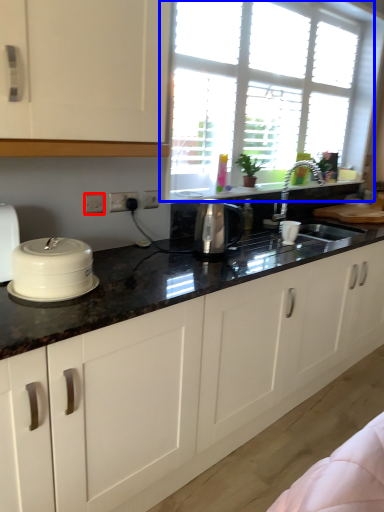
Question: Which of the following is the farthest to the observer, electric outlet (highlighted by a red box) or window (highlighted by a blue box)?

Choices:
 (A) electric outlet
 (B) window

Answer: (B)